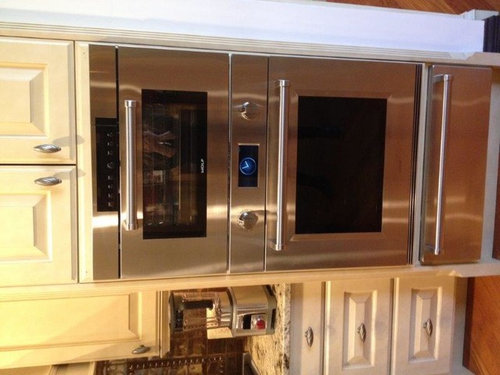
The width and height of the screenshot is (500, 375). Identify the location of warming drawer. (465, 183).